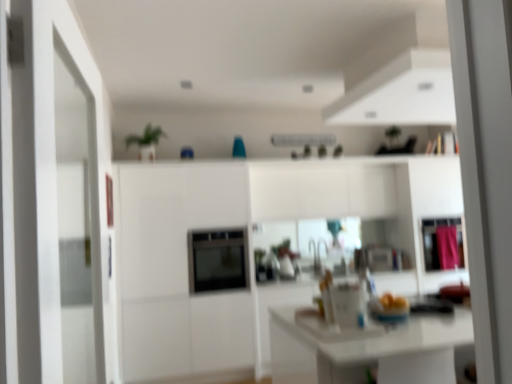
Question: From their relative heights in the image, would you say pink fabric cabinet at right is taller or shorter than pink fabric curtain at right?

Choices:
 (A) tall
 (B) short

Answer: (A)

Question: Is pink fabric cabinet at right spatially inside pink fabric curtain at right, or outside of it?

Choices:
 (A) inside
 (B) outside

Answer: (B)

Question: Which of these objects is positioned farthest from the pink fabric curtain at right?

Choices:
 (A) satin black oven at center
 (B) pink fabric cabinet at right

Answer: (A)

Question: Which object is positioned closest to the satin black oven at center?

Choices:
 (A) pink fabric curtain at right
 (B) pink fabric cabinet at right

Answer: (B)